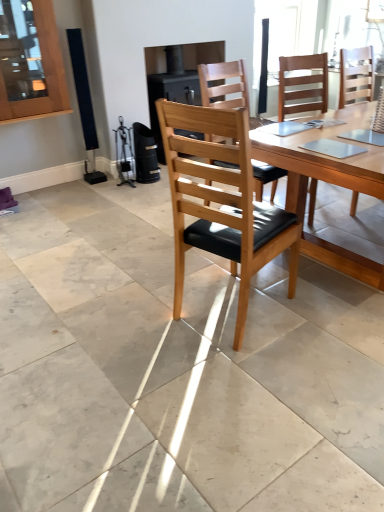
Find the location of a particular element. The height and width of the screenshot is (512, 384). vacant area that is situated to the right of wooden chair with black cushion at center, which is the third chair from back to front is located at coordinates (323, 315).